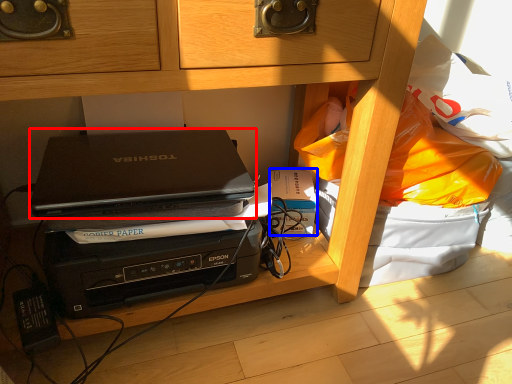
Question: Which object is further to the camera taking this photo, laptop (highlighted by a red box) or paperback book (highlighted by a blue box)?

Choices:
 (A) laptop
 (B) paperback book

Answer: (B)